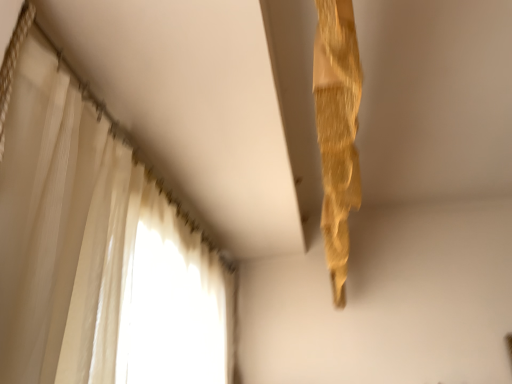
Question: Does white sheer curtain at left, arranged as the 2th curtain when viewed from the right, have a lesser width compared to gold textured curtain at upper right, which appears as the 2th curtain when viewed from the left?

Choices:
 (A) no
 (B) yes

Answer: (A)

Question: Is white sheer curtain at left, which appears as the 1th curtain when viewed from the left, oriented away from gold textured curtain at upper right, the 1th curtain in the right-to-left sequence?

Choices:
 (A) no
 (B) yes

Answer: (A)

Question: Is white sheer curtain at left, arranged as the 2th curtain when viewed from the right, with gold textured curtain at upper right, which appears as the 2th curtain when viewed from the left?

Choices:
 (A) yes
 (B) no

Answer: (B)

Question: Is white sheer curtain at left, which appears as the 1th curtain when viewed from the left, bigger than gold textured curtain at upper right, the 1th curtain in the right-to-left sequence?

Choices:
 (A) no
 (B) yes

Answer: (B)

Question: Does white sheer curtain at left, which appears as the 1th curtain when viewed from the left, turn towards gold textured curtain at upper right, the 1th curtain in the right-to-left sequence?

Choices:
 (A) yes
 (B) no

Answer: (A)

Question: From the image's perspective, would you say white sheer curtain at left, arranged as the 2th curtain when viewed from the right, is positioned over gold textured curtain at upper right, the 1th curtain in the right-to-left sequence?

Choices:
 (A) no
 (B) yes

Answer: (B)

Question: Does gold textured curtain at upper right, which appears as the 2th curtain when viewed from the left, have a smaller size compared to white sheer curtain at left, arranged as the 2th curtain when viewed from the right?

Choices:
 (A) no
 (B) yes

Answer: (B)

Question: Can you confirm if gold textured curtain at upper right, the 1th curtain in the right-to-left sequence, is positioned to the right of white sheer curtain at left, arranged as the 2th curtain when viewed from the right?

Choices:
 (A) no
 (B) yes

Answer: (B)

Question: Is gold textured curtain at upper right, which appears as the 2th curtain when viewed from the left, oriented away from white sheer curtain at left, arranged as the 2th curtain when viewed from the right?

Choices:
 (A) yes
 (B) no

Answer: (A)

Question: Could white sheer curtain at left, arranged as the 2th curtain when viewed from the right, be considered to be inside gold textured curtain at upper right, the 1th curtain in the right-to-left sequence?

Choices:
 (A) no
 (B) yes

Answer: (A)

Question: Is gold textured curtain at upper right, the 1th curtain in the right-to-left sequence, with white sheer curtain at left, which appears as the 1th curtain when viewed from the left?

Choices:
 (A) yes
 (B) no

Answer: (B)

Question: Does gold textured curtain at upper right, the 1th curtain in the right-to-left sequence, have a lesser width compared to white sheer curtain at left, which appears as the 1th curtain when viewed from the left?

Choices:
 (A) no
 (B) yes

Answer: (B)

Question: Do you think gold textured curtain at upper right, which appears as the 2th curtain when viewed from the left, is within white sheer curtain at left, arranged as the 2th curtain when viewed from the right, or outside of it?

Choices:
 (A) inside
 (B) outside

Answer: (B)